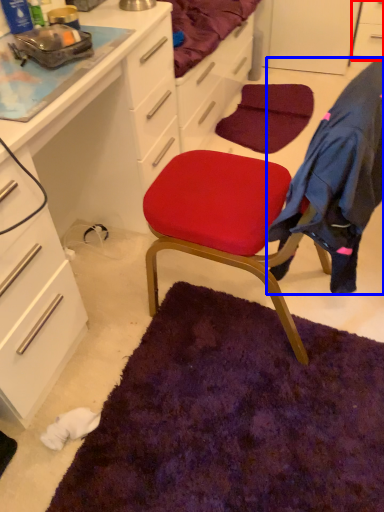
Question: Which point is further to the camera, cabinetry (highlighted by a red box) or clothing (highlighted by a blue box)?

Choices:
 (A) cabinetry
 (B) clothing

Answer: (A)